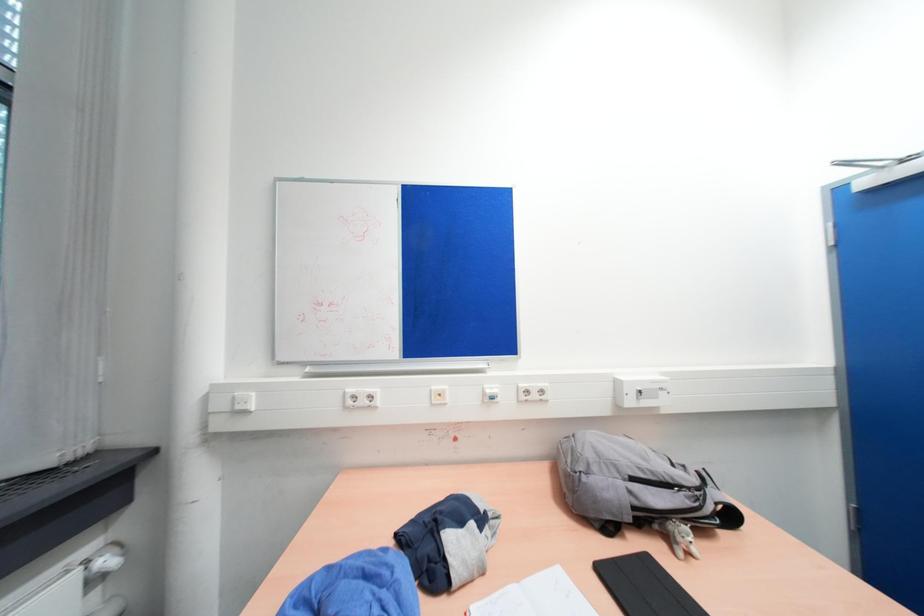
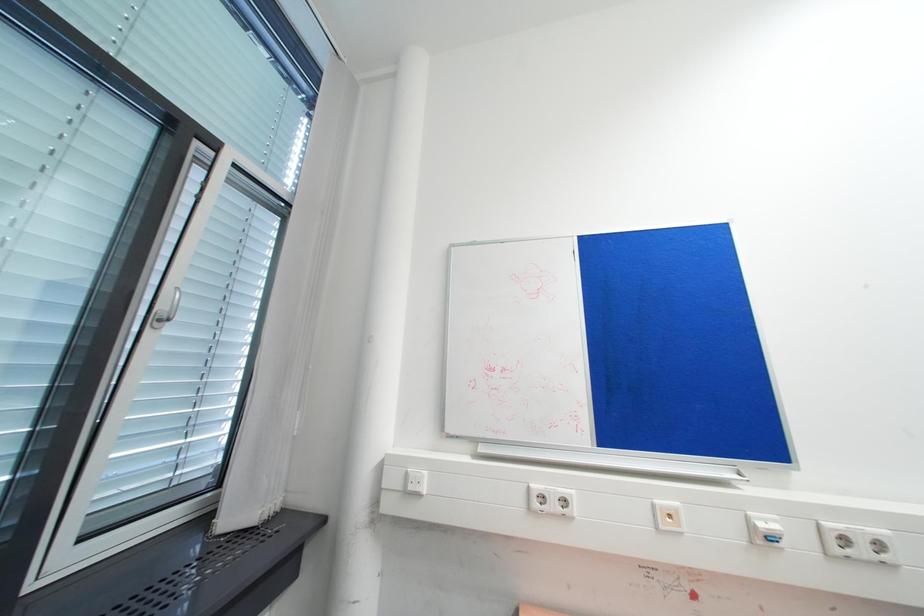
Question: The camera is either moving clockwise (left) or counter-clockwise (right) around the object. The first image is from the beginning of the video and the second image is from the end. Is the camera moving left or right when shooting the video?

Choices:
 (A) Left
 (B) Right

Answer: (B)